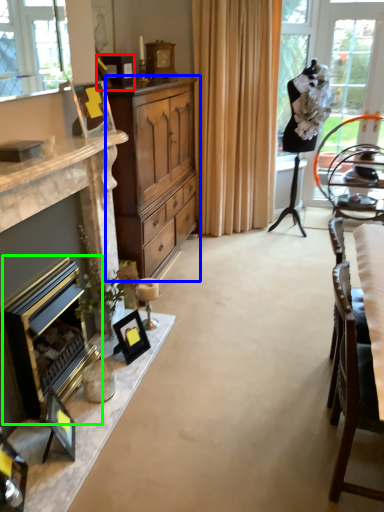
Question: Estimate the real-world distances between objects in this image. Which object is closer to picture frame (highlighted by a red box), cabinetry (highlighted by a blue box) or fireplace (highlighted by a green box)?

Choices:
 (A) cabinetry
 (B) fireplace

Answer: (A)